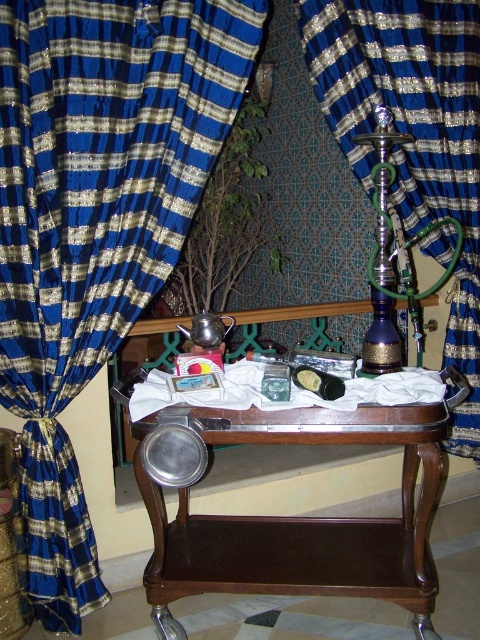
Does blue silk curtain at left appear on the right side of blue silk curtain at center?

No, blue silk curtain at left is not to the right of blue silk curtain at center.

Does blue silk curtain at left lie in front of blue silk curtain at center?

Yes, blue silk curtain at left is in front of blue silk curtain at center.

Between point (92, 35) and point (364, 16), which one is positioned behind?

Positioned behind is point (364, 16).

The width and height of the screenshot is (480, 640). What are the coordinates of `blue silk curtain at left` in the screenshot? It's located at (96, 221).

Is brown wood table at center taller than blue silk curtain at center?

No.

Between brown wood table at center and blue silk curtain at center, which one is positioned higher?

blue silk curtain at center is higher up.

Locate an element on the screen. The width and height of the screenshot is (480, 640). brown wood table at center is located at coordinates (291, 516).

The height and width of the screenshot is (640, 480). Identify the location of blue silk curtain at left. (96, 221).

Describe the element at coordinates (96, 221) in the screenshot. I see `blue silk curtain at left` at that location.

I want to click on blue silk curtain at left, so click(x=96, y=221).